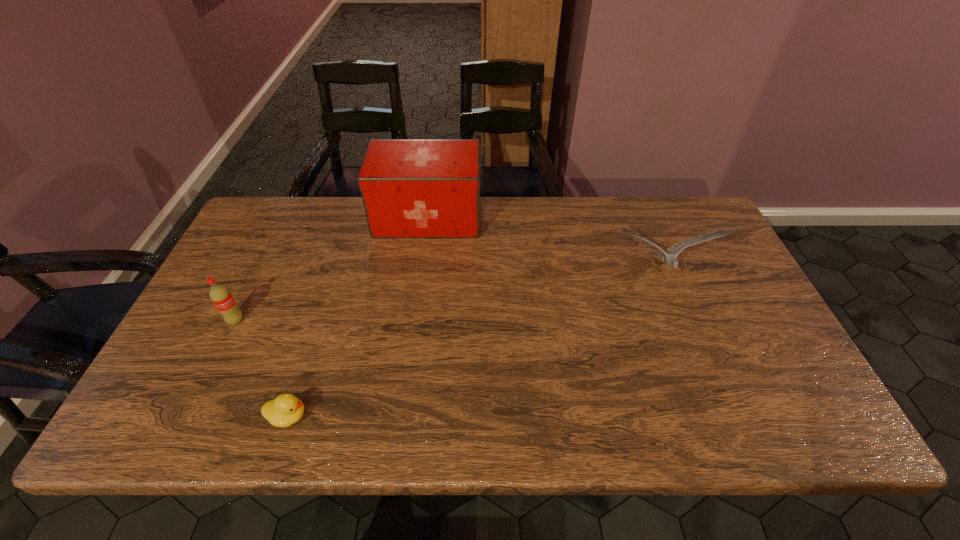
Find the location of `blank region between the duckling and the third nearest object`. blank region between the duckling and the third nearest object is located at coordinates (475, 344).

This screenshot has width=960, height=540. I want to click on object that is the third closest one to the rightmost object, so click(x=220, y=296).

Choose which object is the third nearest neighbor to the rightmost object. Please provide its 2D coordinates. Your answer should be formatted as a tuple, i.e. [(x, y)], where the tuple contains the x and y coordinates of a point satisfying the conditions above.

[(220, 296)]

Identify the location of free space that satisfies the following two spatial constraints: 1. on the handle side of the first-aid kit; 2. on the front side of the second shortest object. This screenshot has width=960, height=540. (415, 320).

Locate an element on the screen. This screenshot has height=540, width=960. blank area in the image that satisfies the following two spatial constraints: 1. at the tip of the beak of the rightmost object; 2. on the beak of the duckling is located at coordinates (719, 416).

At what (x,y) coordinates should I click in order to perform the action: click on free space that satisfies the following two spatial constraints: 1. at the tip of the beak of the gull; 2. on the beak of the nearest object. Please return your answer as a coordinate pair (x, y). Looking at the image, I should click on (719, 416).

This screenshot has height=540, width=960. I want to click on vacant space that satisfies the following two spatial constraints: 1. at the tip of the beak of the third nearest object; 2. on the beak of the second object from left to right, so click(719, 416).